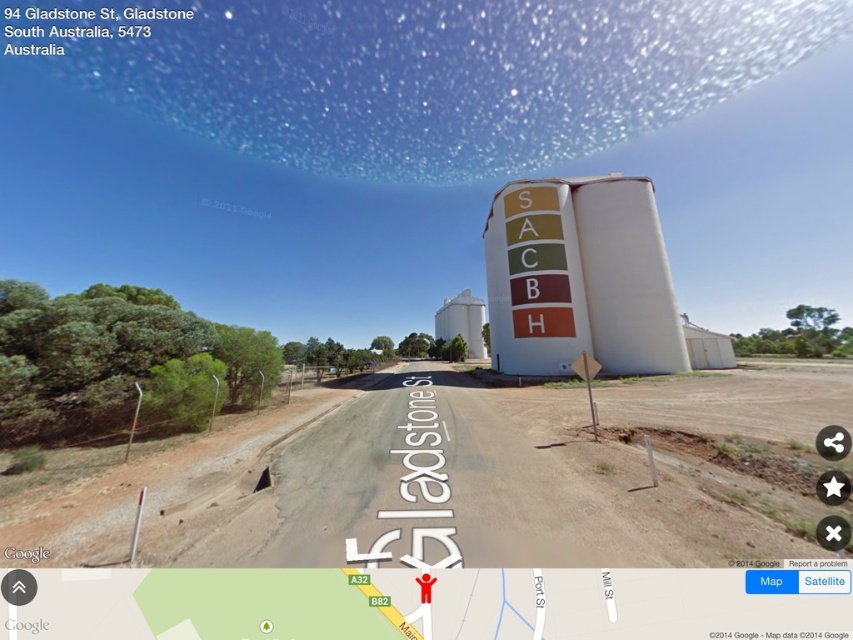
Question: Does brown dirt track at lower left have a lesser width compared to white matte water tower at center?

Choices:
 (A) no
 (B) yes

Answer: (A)

Question: Which object is the closest to the brown dirt track at lower left?

Choices:
 (A) white matte water tower at center
 (B) white matte silo at center

Answer: (B)

Question: Can you confirm if brown dirt track at lower left is positioned below white matte water tower at center?

Choices:
 (A) no
 (B) yes

Answer: (B)

Question: Among these points, which one is farthest from the camera?

Choices:
 (A) click(x=474, y=314)
 (B) click(x=656, y=216)

Answer: (A)

Question: Considering the relative positions of brown dirt track at lower left and white matte silo at center in the image provided, where is brown dirt track at lower left located with respect to white matte silo at center?

Choices:
 (A) below
 (B) above

Answer: (A)

Question: Which of the following is the closest to the observer?

Choices:
 (A) (465, 340)
 (B) (381, 493)

Answer: (B)